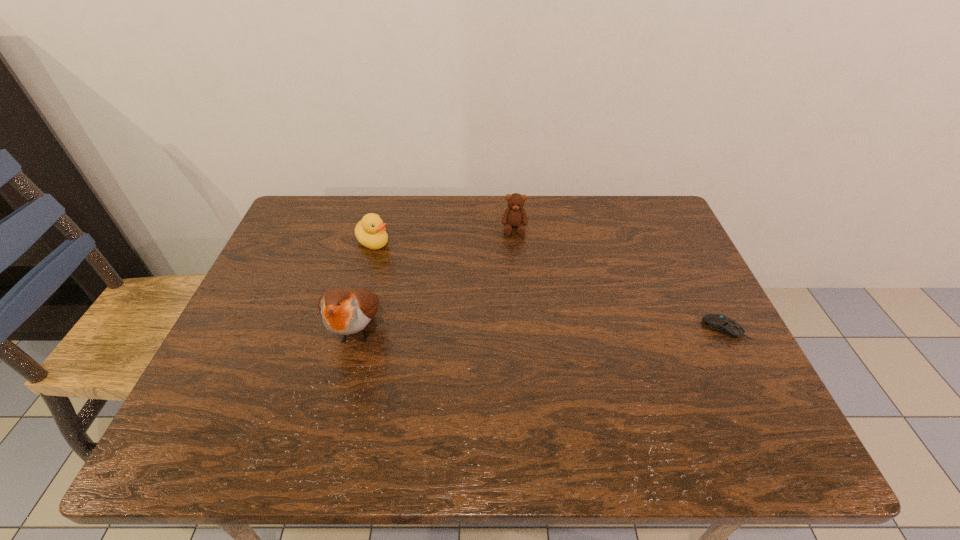
Locate an element on the screen. free space between the rightmost object and the bird is located at coordinates (540, 329).

Where is `free space between the teddy bear and the rightmost object`? free space between the teddy bear and the rightmost object is located at coordinates point(619,279).

Identify which object is the closest to the duckling. Please provide its 2D coordinates. Your answer should be formatted as a tuple, i.e. [(x, y)], where the tuple contains the x and y coordinates of a point satisfying the conditions above.

[(344, 311)]

Where is `object identified as the second closest to the shortest object`? object identified as the second closest to the shortest object is located at coordinates pyautogui.click(x=344, y=311).

I want to click on blank space that satisfies the following two spatial constraints: 1. on the back side of the second object from right to left; 2. on the right side of the duckling, so tap(377, 228).

Locate an element on the screen. The image size is (960, 540). vacant space that satisfies the following two spatial constraints: 1. on the back side of the second object from right to left; 2. on the left side of the duckling is located at coordinates (377, 228).